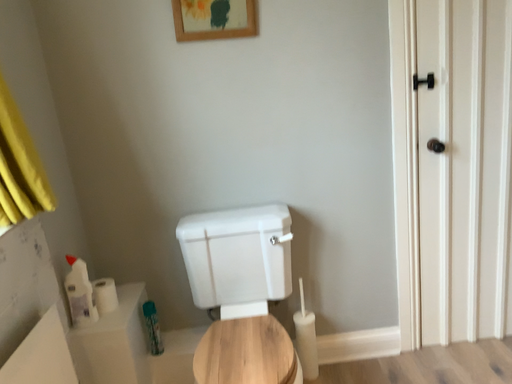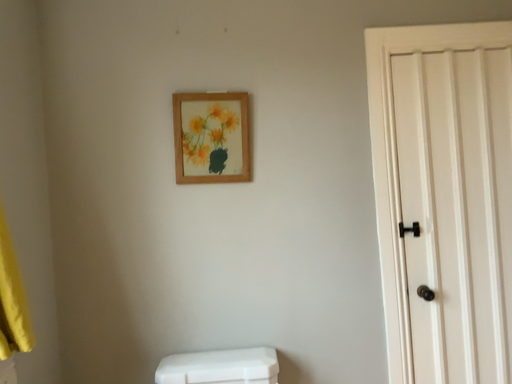
Question: Which way did the camera rotate in the video?

Choices:
 (A) rotated upward
 (B) rotated downward

Answer: (A)